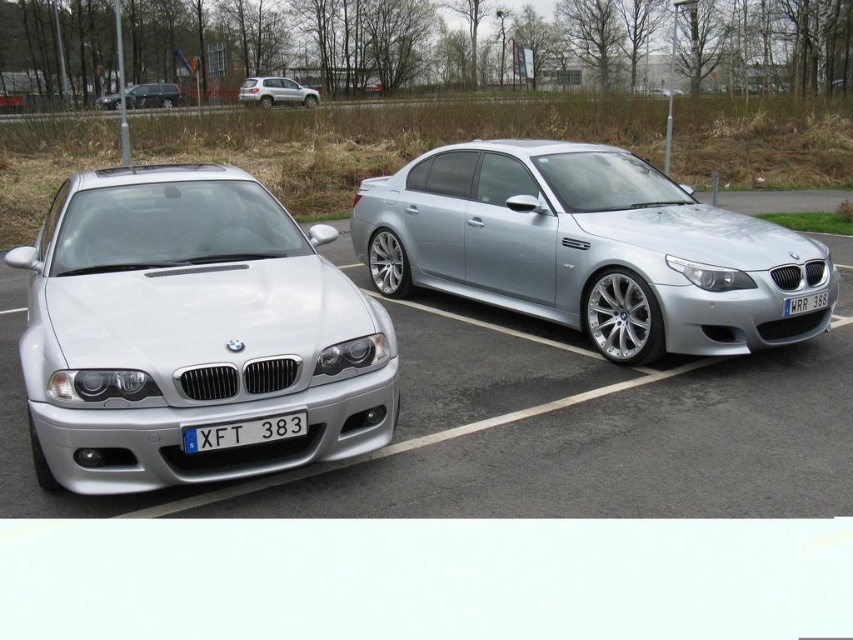
You are standing in front of the two BMW cars and want to determine which point is closer to you. The points are labeled as point 1 at coordinates point (138, 237) and point 2 at coordinates point (242, 83). Which point is closer to your current position?

Point (138, 237) is closer to the camera than point (242, 83), so the point closer to your position is point (138, 237).